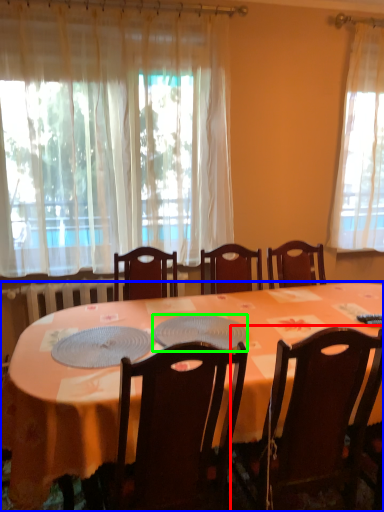
Question: Estimate the real-world distances between objects in this image. Which object is closer to chair (highlighted by a red box), desk (highlighted by a blue box) or platter (highlighted by a green box)?

Choices:
 (A) desk
 (B) platter

Answer: (A)